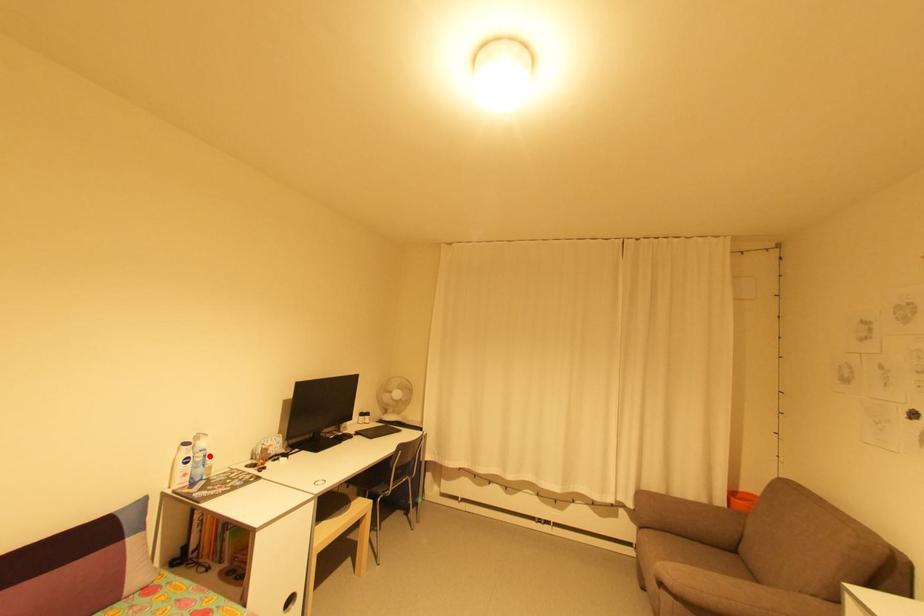
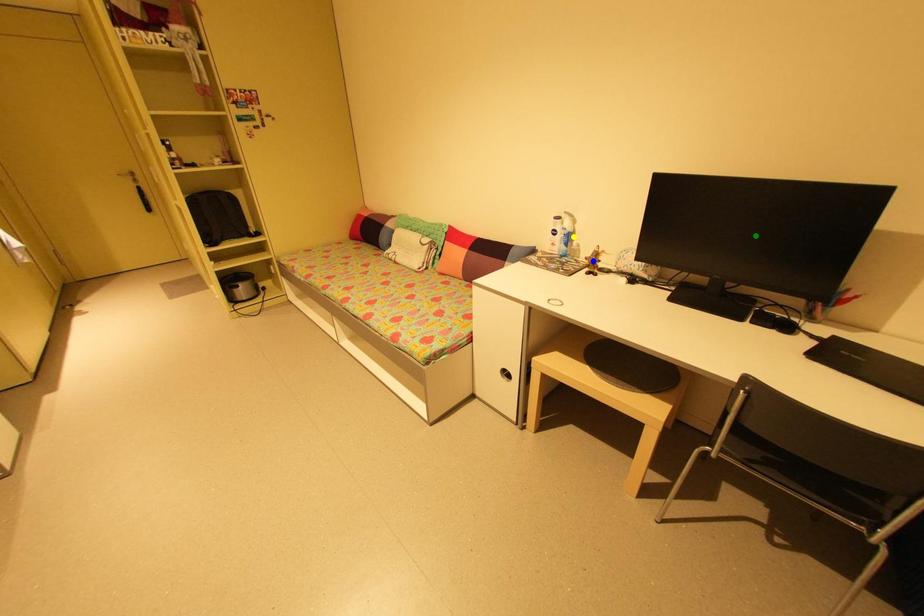
Question: I am providing you with two images of the same scene from different viewpoints. A red point is marked on the first image. You are given multiple points on the second image. Can you choose the point in image 2 that corresponds to the point in image 1?

Choices:
 (A) green point
 (B) yellow point
 (C) blue point

Answer: (B)